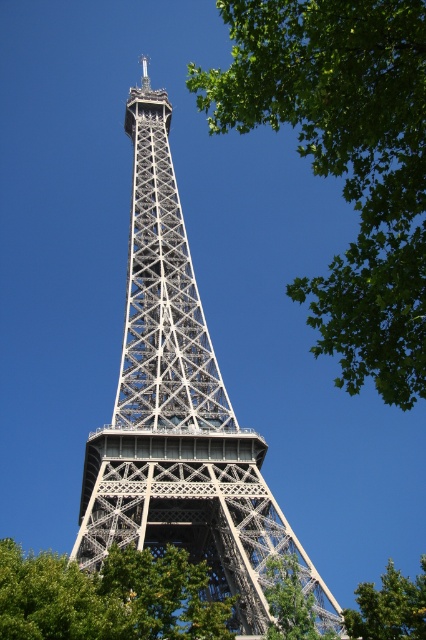
Based on the provided coordinates, where is the green leafy tree at upper right located in the image?

The green leafy tree at upper right is located at the coordinates point (345, 161) in the image.

You are a drone operator planning to fly a drone between the green leafy tree at upper right and the green leafy tree at center. The minimum distance required for safe flight is 40 meters. Based on the scene, can you safely navigate the drone between them?

The green leafy tree at upper right is 38.21 meters away from the green leafy tree at center. Since the required safe distance is 40 meters, the distance between them is insufficient for safe navigation. Therefore, it is not safe to fly the drone between them.